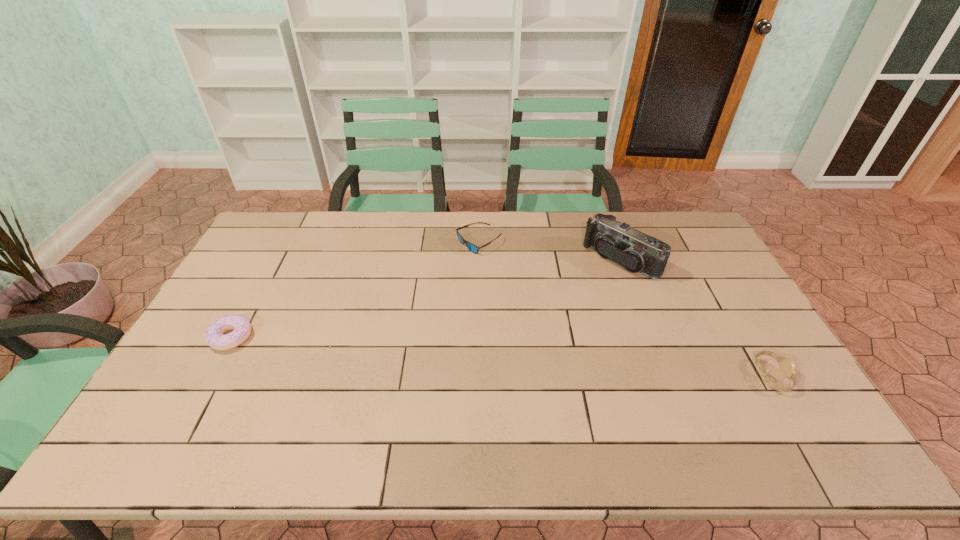
Locate an element on the screen. This screenshot has height=540, width=960. free space on the desktop that is between the doughnut and the nearest object and is positioned on the front-facing side of the tallest object is located at coordinates (501, 356).

The image size is (960, 540). Find the location of `free space on the desktop that is between the leftmost object and the watch and is positioned at the front of the second object from left to right showing the lenses`. free space on the desktop that is between the leftmost object and the watch and is positioned at the front of the second object from left to right showing the lenses is located at coordinates (422, 351).